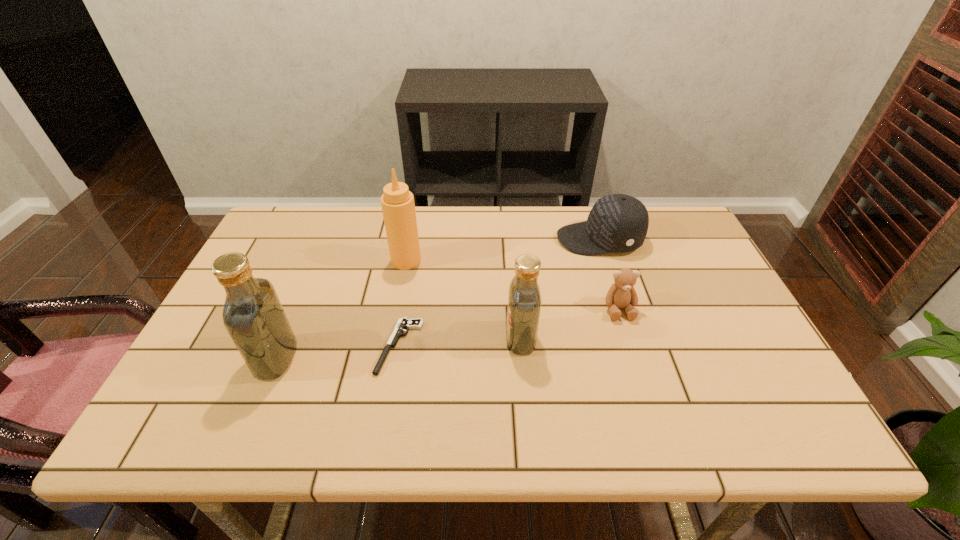
At what (x,y) coordinates should I click in order to perform the action: click on blank area at the near left corner. Please return your answer as a coordinate pair (x, y). Image resolution: width=960 pixels, height=540 pixels. Looking at the image, I should click on (203, 393).

This screenshot has width=960, height=540. I want to click on empty space between the third shortest object and the pistol, so click(499, 293).

You are a GUI agent. You are given a task and a screenshot of the screen. Output one action in this format:
    pyautogui.click(x=<x>, y=<y>)
    Task: Click on the vacant region between the fourth object from left to right and the baseball cap
    This screenshot has width=960, height=540.
    Given the screenshot: What is the action you would take?
    pyautogui.click(x=560, y=289)

Find the location of a particular element. The image size is (960, 540). vacant space in between the leftmost object and the shorter vodka is located at coordinates (398, 348).

Find the location of a particular element. This screenshot has width=960, height=540. free spot between the taller vodka and the second shortest object is located at coordinates (447, 333).

I want to click on empty space between the taller vodka and the baseball cap, so click(x=438, y=299).

The width and height of the screenshot is (960, 540). What are the coordinates of `vacant point located between the fifth tallest object and the third tallest object` in the screenshot? It's located at (570, 323).

This screenshot has width=960, height=540. What are the coordinates of `vacant space that's between the second shortest object and the third shortest object` in the screenshot? It's located at (610, 274).

You are a GUI agent. You are given a task and a screenshot of the screen. Output one action in this format:
    pyautogui.click(x=<x>, y=<y>)
    Task: Click on the free area in between the third tallest object and the pistol
    This screenshot has width=960, height=540.
    Given the screenshot: What is the action you would take?
    pyautogui.click(x=460, y=342)

Find the location of a particular element. The image size is (960, 540). the fourth closest object relative to the pistol is located at coordinates (x=617, y=222).